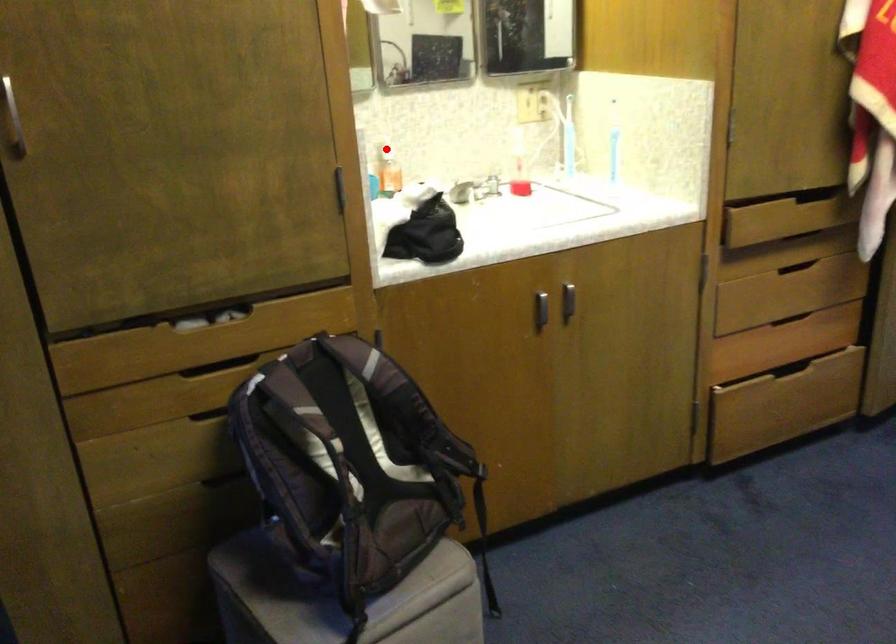
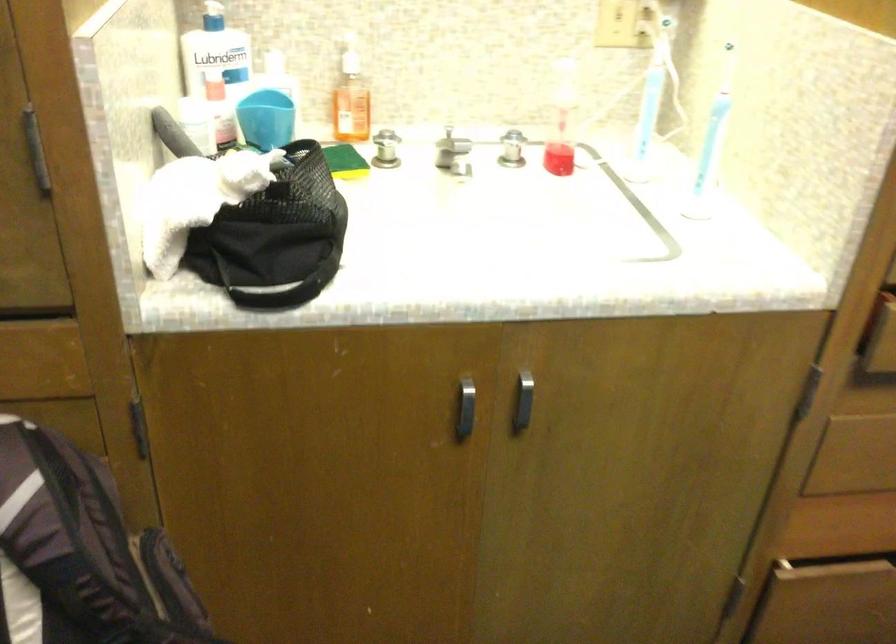
Question: A red point is marked in image1. In image2, is the corresponding 3D point closer to the camera or farther? Reply with the corresponding letter.

Choices:
 (A) The corresponding 3D point is closer.
 (B) The corresponding 3D point is farther.

Answer: (A)